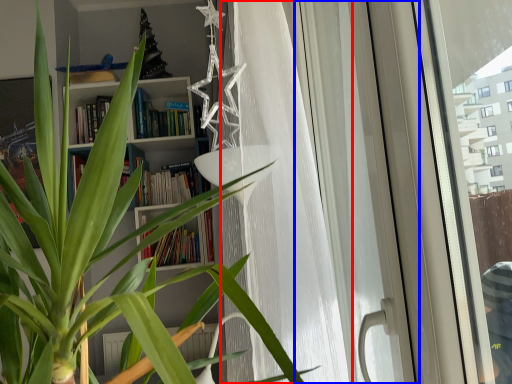
Question: Which point is further to the camera, curtain (highlighted by a red box) or screen door (highlighted by a blue box)?

Choices:
 (A) curtain
 (B) screen door

Answer: (A)